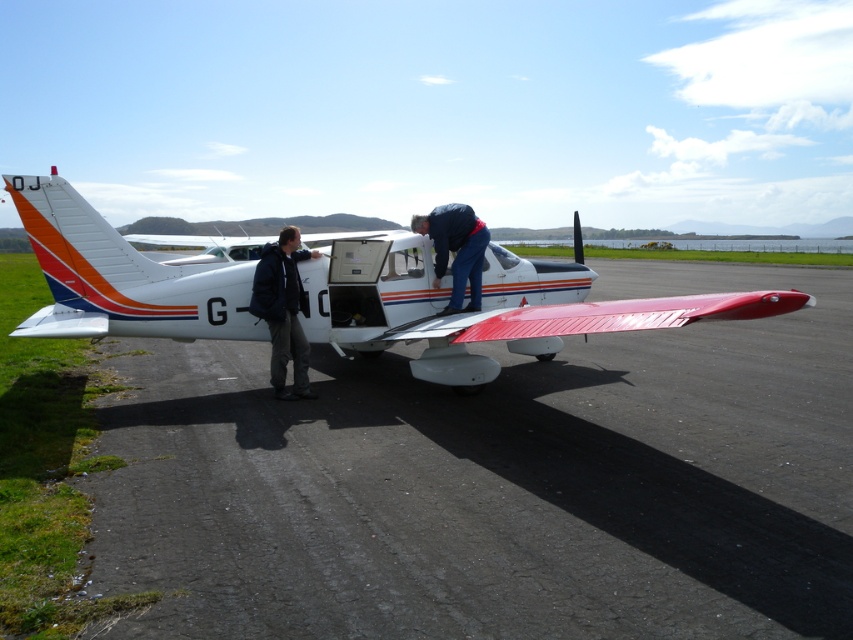
Question: Estimate the real-world distances between objects in this image. Which object is farther from the dark blue jacket at left?

Choices:
 (A) white glossy airplane at center
 (B) blue jeans at center

Answer: (B)

Question: Does white glossy airplane at center come behind blue jeans at center?

Choices:
 (A) no
 (B) yes

Answer: (A)

Question: Does white glossy airplane at center have a greater width compared to blue jeans at center?

Choices:
 (A) yes
 (B) no

Answer: (A)

Question: Does dark blue jacket at left lie in front of blue jeans at center?

Choices:
 (A) no
 (B) yes

Answer: (B)

Question: Which point appears closest to the camera in this image?

Choices:
 (A) (416, 216)
 (B) (461, 378)
 (C) (540, 371)
 (D) (277, 368)

Answer: (B)

Question: Among these objects, which one is farthest from the camera?

Choices:
 (A) smooth asphalt runway at lower center
 (B) dark blue jacket at left
 (C) white glossy airplane at center

Answer: (C)